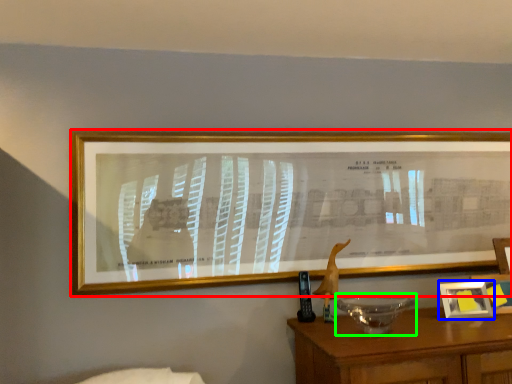
Question: Which is farther away from picture frame (highlighted by a red box)? picture frame (highlighted by a blue box) or glass bowl (highlighted by a green box)?

Choices:
 (A) picture frame
 (B) glass bowl

Answer: (A)